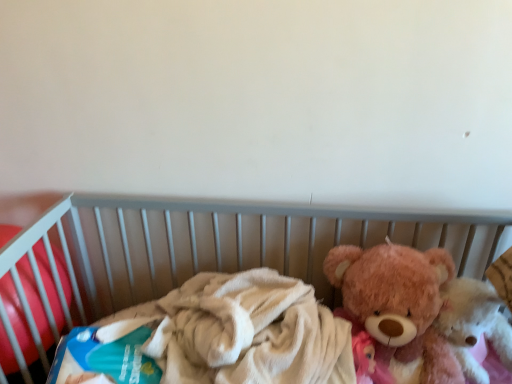
Question: Should I look upward or downward to see fluffy pink teddy bear at right, which ranks as the second teddy bear in left-to-right order?

Choices:
 (A) up
 (B) down

Answer: (B)

Question: From the image's perspective, is fluffy pink teddy bear at right, acting as the 2th teddy bear starting from the right, above soft plush bear at right?

Choices:
 (A) yes
 (B) no

Answer: (A)

Question: Does fluffy pink teddy bear at right, acting as the 2th teddy bear starting from the right, have a lesser width compared to soft plush bear at right?

Choices:
 (A) no
 (B) yes

Answer: (B)

Question: Can you confirm if fluffy pink teddy bear at right, the 1th teddy bear when ordered from left to right, is smaller than soft plush bear at right?

Choices:
 (A) no
 (B) yes

Answer: (B)

Question: Does fluffy pink teddy bear at right, the 1th teddy bear when ordered from left to right, have a larger size compared to soft plush bear at right?

Choices:
 (A) yes
 (B) no

Answer: (B)

Question: Is fluffy pink teddy bear at right, acting as the 2th teddy bear starting from the right, outside soft plush bear at right?

Choices:
 (A) yes
 (B) no

Answer: (B)

Question: Considering the relative sizes of fluffy pink teddy bear at right, the 1th teddy bear when ordered from left to right, and soft plush bear at right in the image provided, is fluffy pink teddy bear at right, the 1th teddy bear when ordered from left to right, shorter than soft plush bear at right?

Choices:
 (A) no
 (B) yes

Answer: (B)

Question: Is blue cardboard box at left not near soft plush bear at right?

Choices:
 (A) yes
 (B) no

Answer: (B)

Question: Does blue cardboard box at left turn towards soft plush bear at right?

Choices:
 (A) yes
 (B) no

Answer: (B)

Question: Is blue cardboard box at left closer to camera compared to soft plush bear at right?

Choices:
 (A) no
 (B) yes

Answer: (A)

Question: From a real-world perspective, is blue cardboard box at left below soft plush bear at right?

Choices:
 (A) yes
 (B) no

Answer: (B)

Question: From the image's perspective, is blue cardboard box at left over soft plush bear at right?

Choices:
 (A) no
 (B) yes

Answer: (B)

Question: Does blue cardboard box at left have a larger size compared to soft plush bear at right?

Choices:
 (A) no
 (B) yes

Answer: (A)

Question: Are soft plush bear at right and blue cardboard box at left far apart?

Choices:
 (A) yes
 (B) no

Answer: (B)